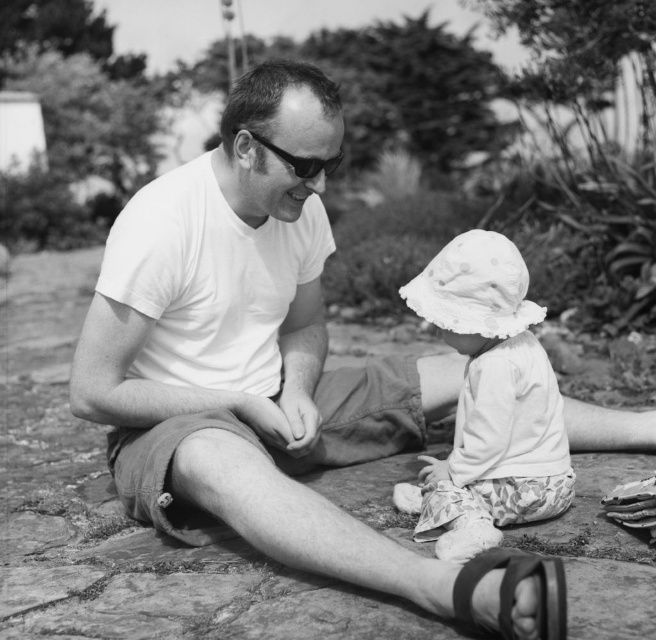
You are a photographer who wants to place a small prop between the black leather sandal at lower center and the black plastic goggles at center in the image. Which side of the goggles should you place it on?

The black leather sandal at lower center is to the right of the black plastic goggles at center, so you should place the prop to the right side of the goggles.

Based on the photo, you are a photographer who wants to capture a closeup of the black plastic goggles at center while ensuring the black leather sandal at lower center is still visible in the frame. Can you fit both objects in the shot without zooming in too much?

The black leather sandal at lower center is smaller than the black plastic goggles at center, so you can fit both in the frame without zooming in too much as the sandal takes up less space.

You are a photographer who wants to capture a closeup of the white dotted fabric hat at center and the black leather sandal at lower center. Which object should you zoom in on first to ensure it fits in the frame?

The white dotted fabric hat at center is larger in size than the black leather sandal at lower center, so you should zoom in on the white dotted fabric hat at center first to ensure it fits in the frame.